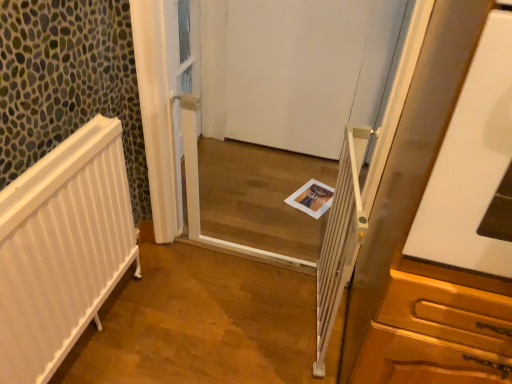
You are a GUI agent. You are given a task and a screenshot of the screen. Output one action in this format:
    pyautogui.click(x=<x>, y=<y>)
    Task: Click on the free space to the back side of white paper magazine at center
    
    Given the screenshot: What is the action you would take?
    click(x=303, y=168)